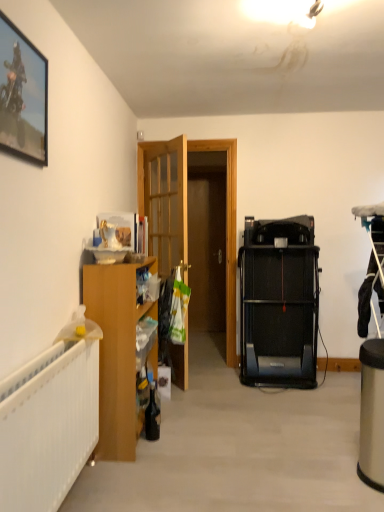
The height and width of the screenshot is (512, 384). What do you see at coordinates (117, 352) in the screenshot? I see `wooden cabinet at left` at bounding box center [117, 352].

The height and width of the screenshot is (512, 384). I want to click on metallic framed picture at upper left, so click(22, 95).

Measure the distance between point (310, 317) and camera.

A distance of 3.45 meters exists between point (310, 317) and camera.

What do you see at coordinates (279, 302) in the screenshot? I see `black plastic treadmill at center-right` at bounding box center [279, 302].

At what (x,y) coordinates should I click in order to perform the action: click on wooden cabinet at left. Please return your answer as a coordinate pair (x, y). The image size is (384, 512). Looking at the image, I should click on (117, 352).

Would you say black plastic treadmill at center-right contains wooden door at center?

No, wooden door at center is not surrounded by black plastic treadmill at center-right.

Find the location of a particular element. The height and width of the screenshot is (512, 384). equipment that is below the wooden door at center (from the image's perspective) is located at coordinates (279, 302).

From the image's perspective, would you say black plastic treadmill at center-right is shown under wooden door at center?

Indeed, from the image's perspective, black plastic treadmill at center-right is shown beneath wooden door at center.

Which object is further away from the camera, black plastic treadmill at center-right or wooden door at center?

black plastic treadmill at center-right is behind.

Which point is more distant from viewer, (102, 434) or (250, 226)?

The point (250, 226) is farther from the camera.

Which object is further away from the camera taking this photo, wooden cabinet at left or black plastic treadmill at center-right?

black plastic treadmill at center-right is further away from the camera.

Is wooden cabinet at left outside of black plastic treadmill at center-right?

That's correct, wooden cabinet at left is outside of black plastic treadmill at center-right.

From a real-world perspective, is metallic framed picture at upper left located beneath black plastic treadmill at center-right?

Incorrect, from a real-world perspective, metallic framed picture at upper left is higher than black plastic treadmill at center-right.

I want to click on equipment located behind the metallic framed picture at upper left, so click(x=279, y=302).

How different are the orientations of metallic framed picture at upper left and black plastic treadmill at center-right in degrees?

The angle between the facing direction of metallic framed picture at upper left and the facing direction of black plastic treadmill at center-right is 92.5 degrees.

Considering the positions of objects metallic framed picture at upper left and black plastic treadmill at center-right in the image provided, who is in front, metallic framed picture at upper left or black plastic treadmill at center-right?

metallic framed picture at upper left is in front.

Considering their positions, is wooden door at center located in front of or behind metallic framed picture at upper left?

Clearly, wooden door at center is behind metallic framed picture at upper left.

In the scene shown: Measure the distance from wooden door at center to metallic framed picture at upper left.

5.96 feet.

Is wooden door at center aimed at metallic framed picture at upper left?

No.

Considering the sizes of objects wooden door at center and metallic framed picture at upper left in the image provided, who is shorter, wooden door at center or metallic framed picture at upper left?

metallic framed picture at upper left is shorter.

From the picture: From a real-world perspective, which object rests below the other?

wooden cabinet at left is physically lower.

This screenshot has width=384, height=512. In order to click on equipment lying on the right of wooden cabinet at left in this screenshot , I will do pyautogui.click(x=279, y=302).

Considering the relative sizes of black plastic treadmill at center-right and wooden cabinet at left in the image provided, is black plastic treadmill at center-right taller than wooden cabinet at left?

Yes.

How different are the orientations of black plastic treadmill at center-right and wooden cabinet at left in degrees?

92.5 degrees.

Is metallic framed picture at upper left facing towards wooden cabinet at left?

No, metallic framed picture at upper left does not turn towards wooden cabinet at left.

I want to click on picture frame that appears above the wooden cabinet at left (from the image's perspective), so click(22, 95).

From the image's perspective, is metallic framed picture at upper left located beneath wooden cabinet at left?

No, from the image's perspective, metallic framed picture at upper left is not below wooden cabinet at left.

Does metallic framed picture at upper left contain wooden cabinet at left?

No, wooden cabinet at left is located outside of metallic framed picture at upper left.

Would you say black plastic treadmill at center-right is outside metallic framed picture at upper left?

That's correct, black plastic treadmill at center-right is outside of metallic framed picture at upper left.

Is point (278, 332) closer to camera compared to point (22, 114)?

No, it is not.

Is black plastic treadmill at center-right far away from metallic framed picture at upper left?

Yes, black plastic treadmill at center-right and metallic framed picture at upper left are located far from each other.

I want to click on door in front of the black plastic treadmill at center-right, so click(x=164, y=199).

Identify the location of cabinetry that appears below the black plastic treadmill at center-right (from a real-world perspective). The image size is (384, 512). (117, 352).

Looking at the image, which one is located further to metallic framed picture at upper left, wooden cabinet at left or black plastic treadmill at center-right?

The object further to metallic framed picture at upper left is black plastic treadmill at center-right.

Which object lies further to the anchor point metallic framed picture at upper left, black plastic treadmill at center-right or wooden cabinet at left?

The object further to metallic framed picture at upper left is black plastic treadmill at center-right.

Based on their spatial positions, is black plastic treadmill at center-right or wooden door at center further from wooden cabinet at left?

The object further to wooden cabinet at left is black plastic treadmill at center-right.

Looking at the image, which one is located further to metallic framed picture at upper left, black plastic treadmill at center-right or wooden door at center?

black plastic treadmill at center-right.

Considering their positions, is wooden door at center positioned closer to black plastic treadmill at center-right than wooden cabinet at left?

Among the two, wooden door at center is located nearer to black plastic treadmill at center-right.

When comparing their distances from wooden cabinet at left, does black plastic treadmill at center-right or metallic framed picture at upper left seem closer?

metallic framed picture at upper left lies closer to wooden cabinet at left than the other object.

Based on their spatial positions, is wooden door at center or wooden cabinet at left further from metallic framed picture at upper left?

wooden door at center.

Based on their spatial positions, is wooden door at center or metallic framed picture at upper left further from wooden cabinet at left?

wooden door at center is further to wooden cabinet at left.

Image resolution: width=384 pixels, height=512 pixels. I want to click on door between metallic framed picture at upper left and black plastic treadmill at center-right in the front-back direction, so click(164, 199).

Identify the location of cabinetry between metallic framed picture at upper left and wooden door at center along the z-axis. (117, 352).

In order to click on cabinetry between metallic framed picture at upper left and black plastic treadmill at center-right in the front-back direction in this screenshot , I will do `click(117, 352)`.

Image resolution: width=384 pixels, height=512 pixels. I want to click on door between wooden cabinet at left and black plastic treadmill at center-right in the horizontal direction, so click(164, 199).